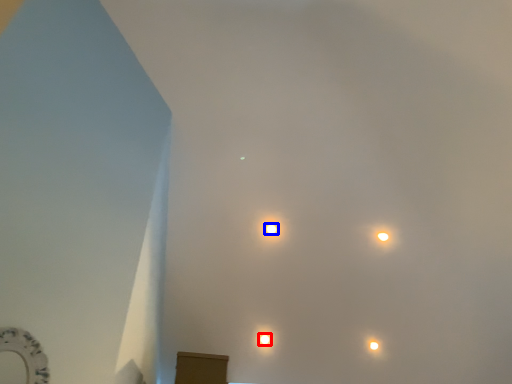
Question: Which of the following is the closest to the observer, lamp (highlighted by a red box) or lamp (highlighted by a blue box)?

Choices:
 (A) lamp
 (B) lamp

Answer: (B)